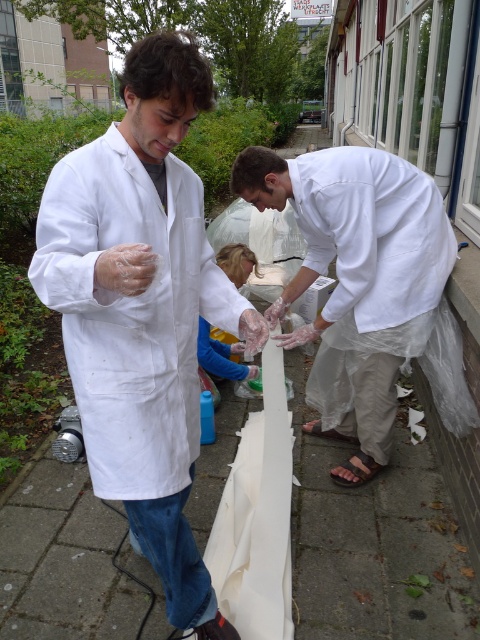
Can you confirm if white matte lab coat at center is positioned to the right of white matte lab coat at right?

Incorrect, white matte lab coat at center is not on the right side of white matte lab coat at right.

Is white matte lab coat at center further to camera compared to white matte lab coat at right?

No, white matte lab coat at center is in front of white matte lab coat at right.

Who is more distant from viewer, (101, 323) or (345, 236)?

Point (345, 236)

Image resolution: width=480 pixels, height=640 pixels. Identify the location of white matte lab coat at center. (142, 310).